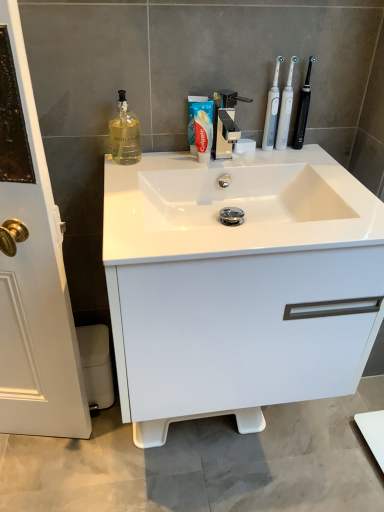
Locate an element on the screen. The height and width of the screenshot is (512, 384). vacant space situated on the left part of white matte toothpaste at center is located at coordinates (151, 164).